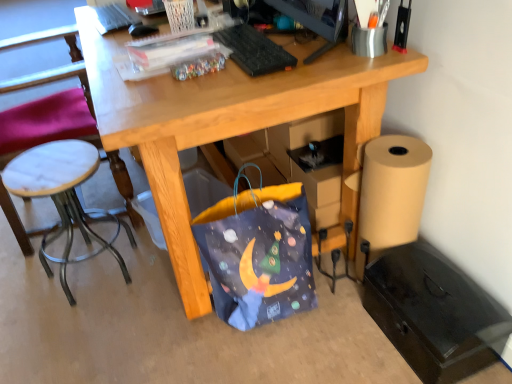
Locate an element on the screen. vacant point to the left of white marble stool at left is located at coordinates point(25,279).